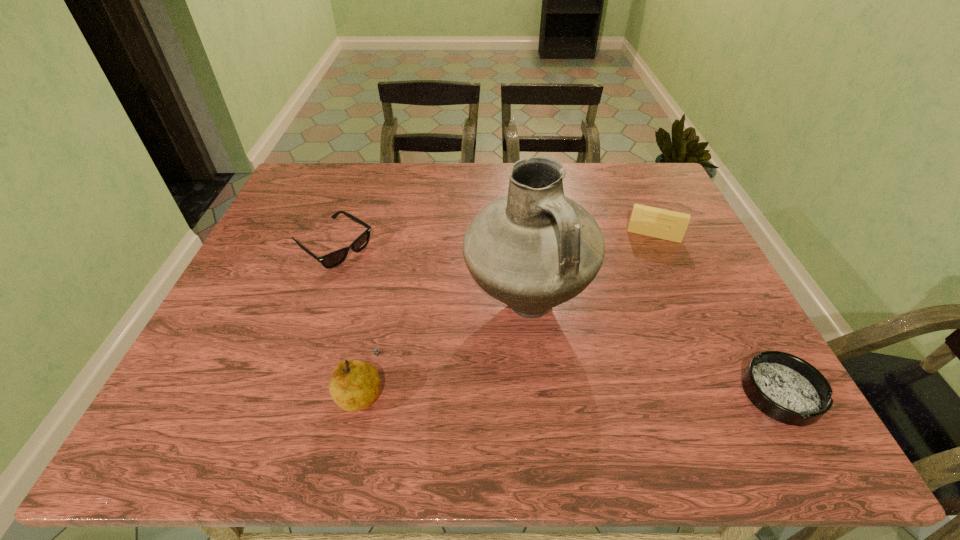
Find the location of `vacant space located on the front-facing side of the fourth tallest object`. vacant space located on the front-facing side of the fourth tallest object is located at coordinates (391, 285).

Image resolution: width=960 pixels, height=540 pixels. I want to click on vacant space located on the front-facing side of the fourth tallest object, so click(x=465, y=334).

Where is `vacant space located 0.110m on the front-facing side of the fourth tallest object`? The width and height of the screenshot is (960, 540). vacant space located 0.110m on the front-facing side of the fourth tallest object is located at coordinates (388, 284).

This screenshot has width=960, height=540. I want to click on free space located 0.190m at the front of the third shortest object with spools, so [640, 290].

You are a GUI agent. You are given a task and a screenshot of the screen. Output one action in this format:
    pyautogui.click(x=<x>, y=<y>)
    Task: Click on the vacant space situated at the front of the third shortest object with spools
    
    Given the screenshot: What is the action you would take?
    pyautogui.click(x=636, y=316)

Find the location of a particular element. The height and width of the screenshot is (540, 960). vacant space located 0.320m at the front of the third shortest object with spools is located at coordinates (634, 329).

At what (x,y) coordinates should I click in order to perform the action: click on vacant space located on the handle side of the third object from right to left. Please return your answer as a coordinate pair (x, y). The image size is (960, 540). Looking at the image, I should click on (598, 364).

The image size is (960, 540). In order to click on free spot located 0.160m on the handle side of the third object from right to left in this screenshot , I will do (x=634, y=394).

Locate an element on the screen. This screenshot has height=540, width=960. free point located 0.060m on the handle side of the third object from right to left is located at coordinates (594, 361).

Find the location of a particular element. Image resolution: width=960 pixels, height=540 pixels. pear located at the near edge is located at coordinates (354, 385).